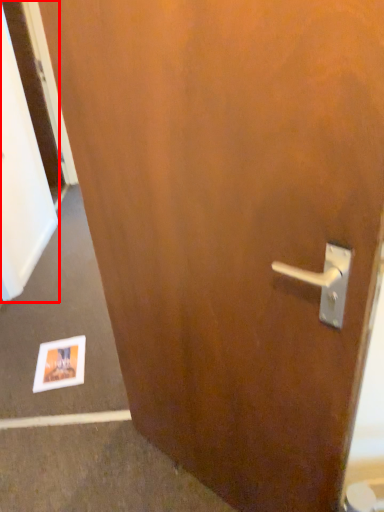
Question: From the image's perspective, considering the relative positions of screen door (annotated by the red box) and postcard in the image provided, where is screen door (annotated by the red box) located with respect to the staircase?

Choices:
 (A) above
 (B) below

Answer: (A)